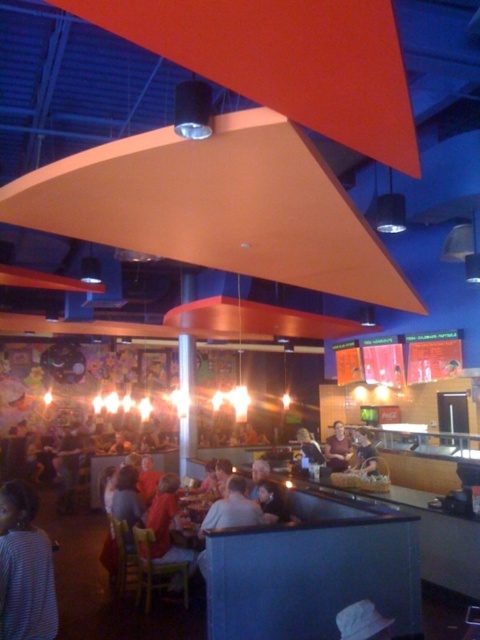
You are a customer in this restaurant and you see two jackets hanging on a rack. The light brown leather jacket at lower center and the dark brown leather jacket at center. Which jacket is placed higher on the rack?

The light brown leather jacket at lower center is placed higher on the rack than the dark brown leather jacket at center.

You are a photographer trying to capture a candid shot of the striped shirt at lower left and the light brown leather jacket at lower center. Since you want to ensure both are in focus, you need to know their relative sizes. Which one is smaller?

The striped shirt at lower left has a smaller size compared to the light brown leather jacket at lower center, so the striped shirt at lower left is smaller.

You are a customer in the restaurant and want to hang your light brown leather jacket at lower center and smooth beige shirt at center on the coat rack. Which one should you place on the top to avoid the jacket dragging on the floor?

The light brown leather jacket at lower center is taller than the smooth beige shirt at center, so you should place the light brown leather jacket at lower center on the top to prevent it from dragging on the floor.